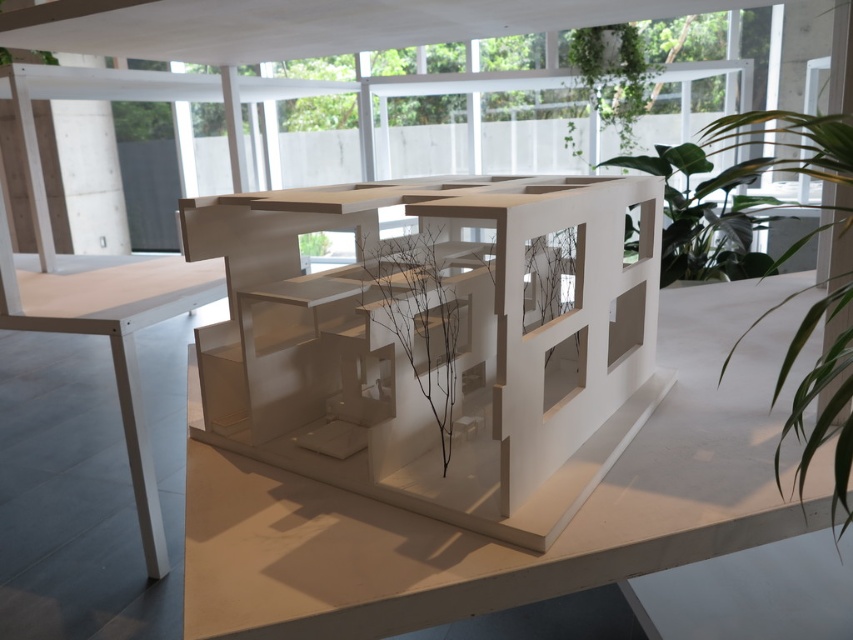
Does white matte table at left have a larger size compared to green leafy plant at upper center?

Yes.

How far apart are white matte table at left and green leafy plant at upper center?

The distance of white matte table at left from green leafy plant at upper center is 13.58 feet.

Measure the distance between point (218, 275) and camera.

9.25 feet

Where is `white matte table at left`? The image size is (853, 640). white matte table at left is located at coordinates pyautogui.click(x=115, y=339).

Who is positioned more to the right, white matte table at left or green leafy plant at upper right?

Positioned to the right is green leafy plant at upper right.

Is white matte table at left bigger than green leafy plant at upper right?

No.

The width and height of the screenshot is (853, 640). I want to click on white matte table at left, so click(x=115, y=339).

Is brown matte branch at center closer to the viewer compared to green leafy plant at upper right?

No, it is behind green leafy plant at upper right.

Can you confirm if brown matte branch at center is bigger than green leafy plant at upper right?

No.

Does point (427, 448) come behind point (827, 282)?

That is False.

In order to click on brown matte branch at center in this screenshot , I will do `click(426, 337)`.